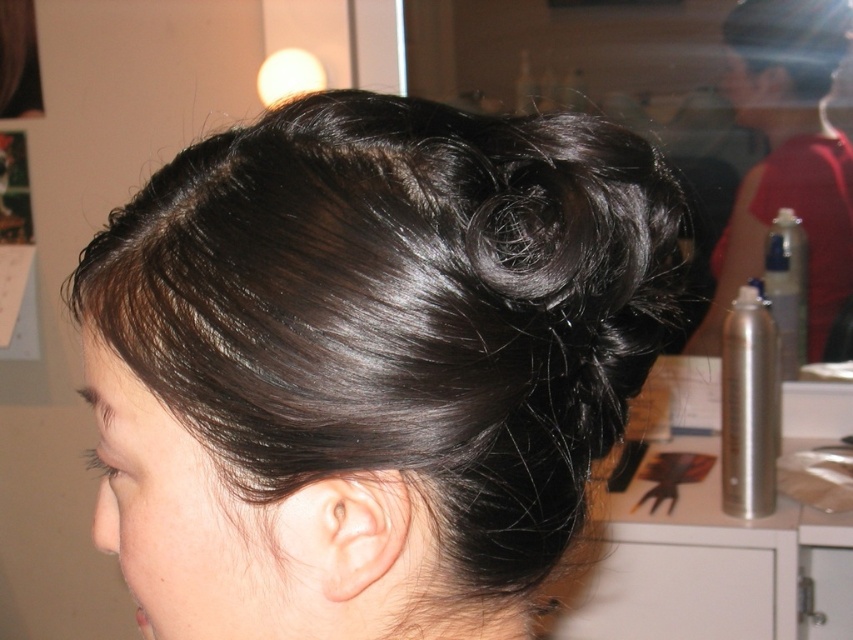
Between silver metallic spray can at right and shiny dark brown hair at upper center, which one appears on the right side from the viewer's perspective?

silver metallic spray can at right is more to the right.

Who is more distant from viewer, (x=840, y=204) or (x=786, y=17)?

The point (x=840, y=204) is more distant.

Identify the location of silver metallic spray can at right. The height and width of the screenshot is (640, 853). (786, 154).

Which is above, shiny dark hair bun at upper center or shiny dark brown hair at upper center?

shiny dark brown hair at upper center

Can you confirm if shiny dark hair bun at upper center is wider than shiny dark brown hair at upper center?

In fact, shiny dark hair bun at upper center might be narrower than shiny dark brown hair at upper center.

Between point (459, 179) and point (808, 45), which one is positioned behind?

Positioned behind is point (808, 45).

I want to click on shiny dark hair bun at upper center, so click(x=370, y=358).

Describe the element at coordinates (370, 358) in the screenshot. I see `shiny dark hair bun at upper center` at that location.

Is point (392, 540) more distant than point (824, 269)?

No.

Image resolution: width=853 pixels, height=640 pixels. In order to click on shiny dark hair bun at upper center in this screenshot , I will do `click(370, 358)`.